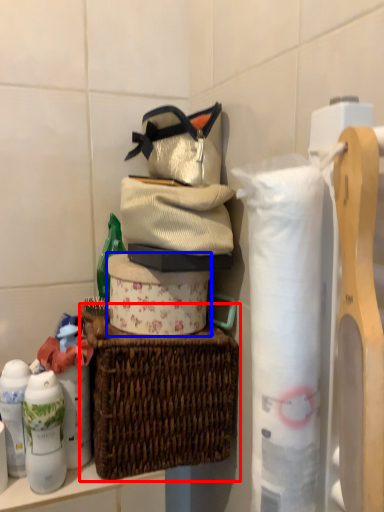
Question: Among these objects, which one is farthest to the camera, picnic basket (highlighted by a red box) or toilet paper (highlighted by a blue box)?

Choices:
 (A) picnic basket
 (B) toilet paper

Answer: (B)